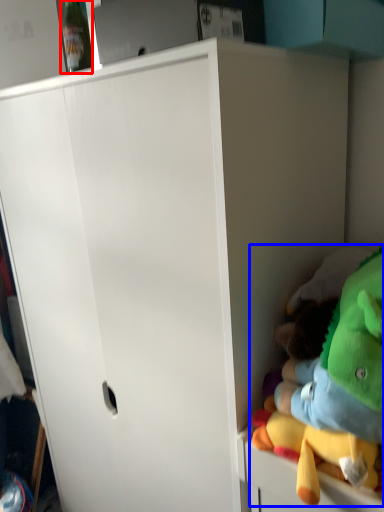
Question: Which of the following is the closest to the observer, bottle (highlighted by a red box) or toy (highlighted by a blue box)?

Choices:
 (A) bottle
 (B) toy

Answer: (B)